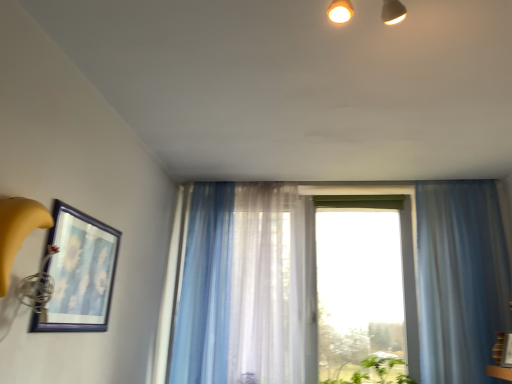
Question: Is matte blue picture frame at left positioned with its back to translucent blue curtain at center, placed as the 3th curtain when sorted from right to left?

Choices:
 (A) no
 (B) yes

Answer: (A)

Question: Considering the relative sizes of matte blue picture frame at left and translucent blue curtain at center, the 1th curtain viewed from the left, in the image provided, is matte blue picture frame at left thinner than translucent blue curtain at center, the 1th curtain viewed from the left,?

Choices:
 (A) no
 (B) yes

Answer: (B)

Question: Does matte blue picture frame at left come behind translucent blue curtain at center, the 1th curtain viewed from the left?

Choices:
 (A) no
 (B) yes

Answer: (A)

Question: Considering the relative positions of matte blue picture frame at left and translucent blue curtain at center, the 1th curtain viewed from the left, in the image provided, is matte blue picture frame at left to the right of translucent blue curtain at center, the 1th curtain viewed from the left, from the viewer's perspective?

Choices:
 (A) yes
 (B) no

Answer: (B)

Question: From the image's perspective, does matte blue picture frame at left appear lower than translucent blue curtain at center, placed as the 3th curtain when sorted from right to left?

Choices:
 (A) no
 (B) yes

Answer: (A)

Question: From the image's perspective, relative to translucent fabric curtain at center, which is the second curtain in left-to-right order, is translucent blue curtain at center, the 1th curtain viewed from the left, above or below?

Choices:
 (A) above
 (B) below

Answer: (B)

Question: Is translucent blue curtain at center, the 1th curtain viewed from the left, taller or shorter than translucent fabric curtain at center, which is the second curtain in left-to-right order?

Choices:
 (A) tall
 (B) short

Answer: (A)

Question: Is translucent blue curtain at center, the 1th curtain viewed from the left, spatially inside translucent fabric curtain at center, which is the second curtain in left-to-right order, or outside of it?

Choices:
 (A) outside
 (B) inside

Answer: (A)

Question: Would you say translucent blue curtain at center, the 1th curtain viewed from the left, is to the left or to the right of translucent fabric curtain at center, placed as the second curtain when sorted from right to left, in the picture?

Choices:
 (A) right
 (B) left

Answer: (B)

Question: From a real-world perspective, is translucent fabric curtain at center, placed as the second curtain when sorted from right to left, above or below matte blue picture frame at left?

Choices:
 (A) below
 (B) above

Answer: (B)

Question: Is translucent fabric curtain at center, placed as the second curtain when sorted from right to left, bigger or smaller than matte blue picture frame at left?

Choices:
 (A) big
 (B) small

Answer: (A)

Question: Would you say translucent fabric curtain at center, placed as the second curtain when sorted from right to left, is to the left or to the right of matte blue picture frame at left in the picture?

Choices:
 (A) right
 (B) left

Answer: (A)

Question: Choose the correct answer: Is translucent fabric curtain at center, placed as the second curtain when sorted from right to left, inside matte blue picture frame at left or outside it?

Choices:
 (A) inside
 (B) outside

Answer: (B)

Question: Considering the positions of point (105, 269) and point (244, 274), is point (105, 269) closer or farther from the camera than point (244, 274)?

Choices:
 (A) farther
 (B) closer

Answer: (B)

Question: Based on their positions, is matte blue picture frame at left located to the left or right of translucent fabric curtain at center, which is the second curtain in left-to-right order?

Choices:
 (A) right
 (B) left

Answer: (B)